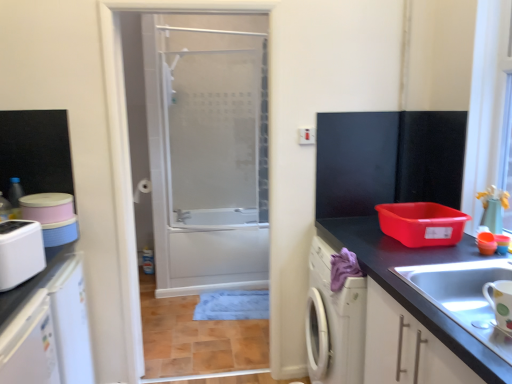
Question: Is transparent glass door at center situated inside white plastic toaster at left, positioned as the 2th appliance in right-to-left order, or outside?

Choices:
 (A) inside
 (B) outside

Answer: (B)

Question: Considering their positions, is transparent glass door at center located in front of or behind white plastic toaster at left, arranged as the second appliance when viewed from the front?

Choices:
 (A) behind
 (B) front

Answer: (A)

Question: Which of these objects is positioned farthest from the white plastic toaster at left, positioned as the 2th appliance in right-to-left order?

Choices:
 (A) white glossy mug at lower right, the 2th appliance positioned from the left
 (B) white matte cabinet at lower right
 (C) matte black countertop at right
 (D) transparent glass door at center
 (E) matte silver faucet at upper center

Answer: (D)

Question: Estimate the real-world distances between objects in this image. Which object is farther from the white glossy mug at lower right, which ranks as the 1th appliance in front-to-back order?

Choices:
 (A) matte silver faucet at upper center
 (B) white plastic toaster at left, positioned as the 2th appliance in right-to-left order
 (C) transparent glass door at center
 (D) white matte cabinet at lower right
 (E) matte black countertop at right

Answer: (C)